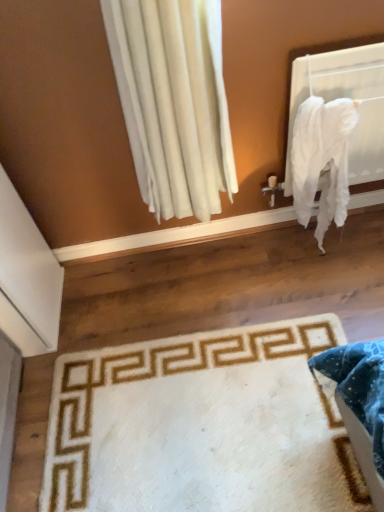
Identify the location of unoccupied space behind white plush rug at lower center. (187, 296).